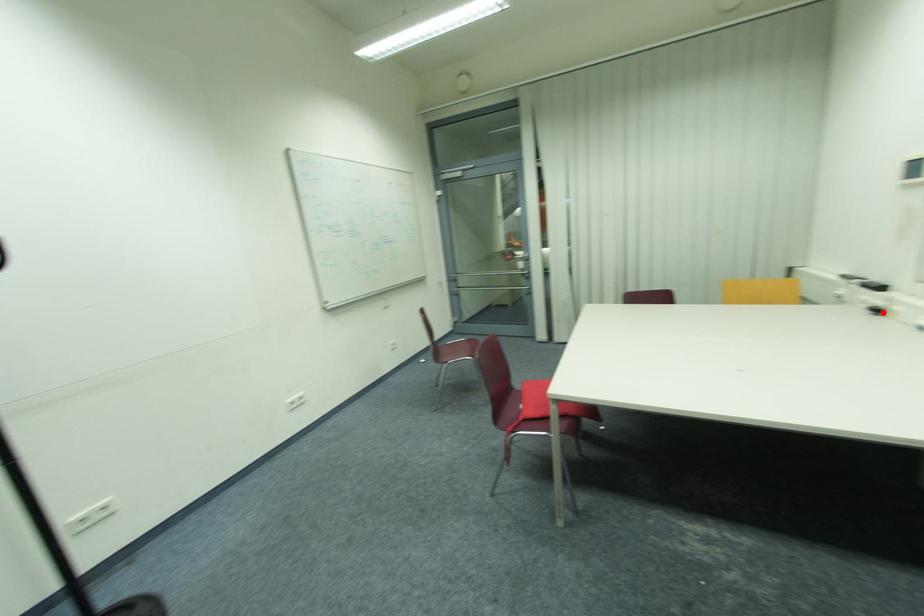
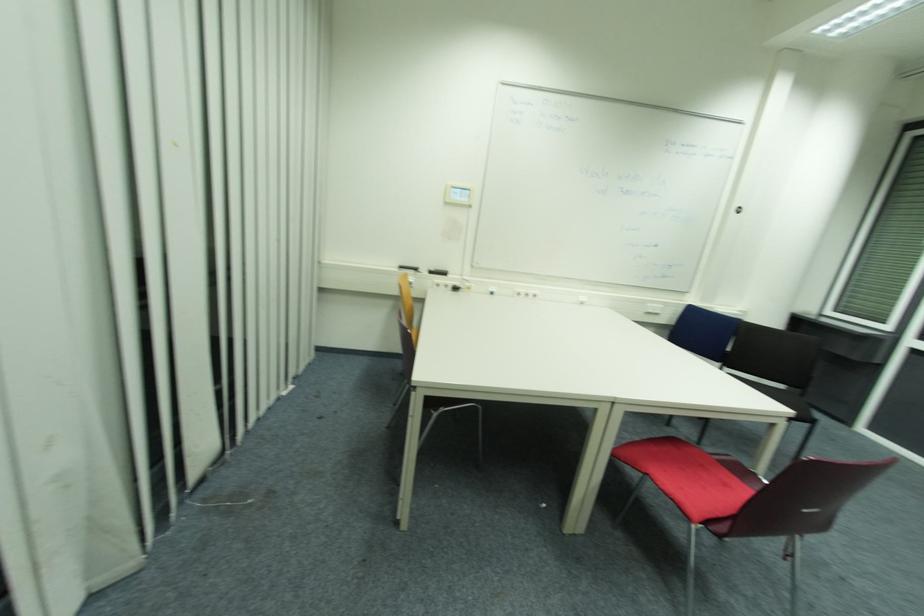
Find the pixel in the second image that matches the highlighted location in the first image.

(458, 290)